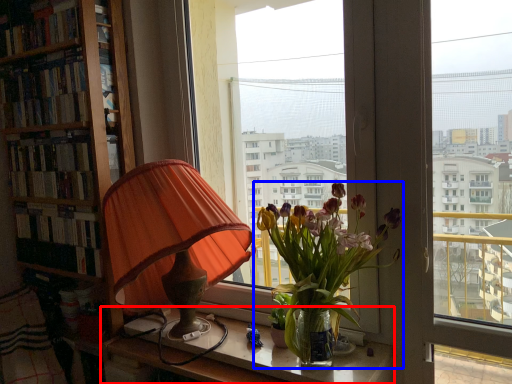
Question: Which point is further to the camera, table (highlighted by a red box) or houseplant (highlighted by a blue box)?

Choices:
 (A) table
 (B) houseplant

Answer: (A)